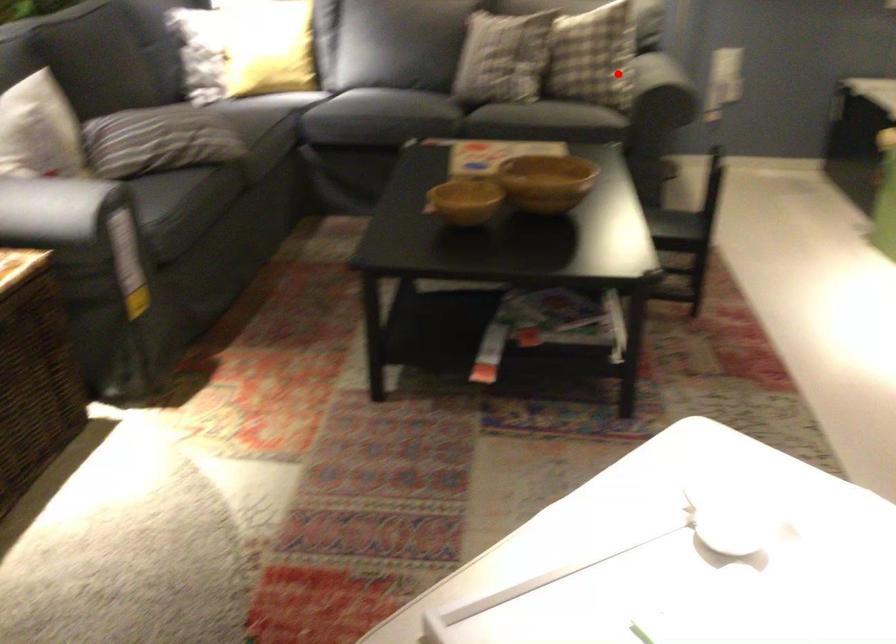
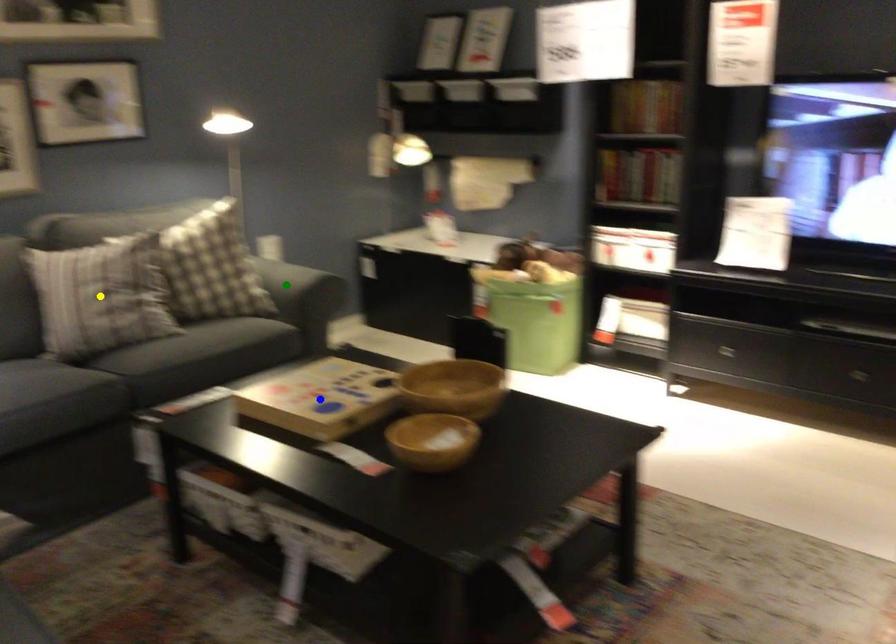
Question: I am providing you with two images of the same scene from different viewpoints. A red point is marked on the first image. You are given multiple points on the second image. Can you choose the point in image 2 that corresponds to the point in image 1?

Choices:
 (A) yellow point
 (B) green point
 (C) blue point

Answer: (B)